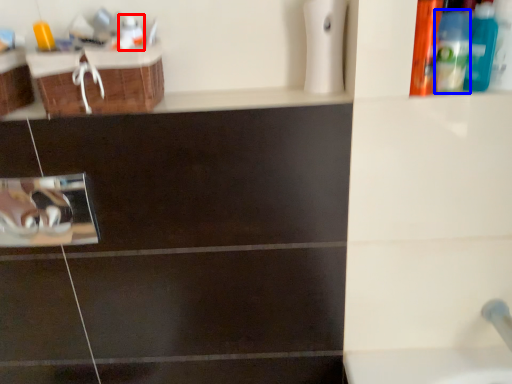
Question: Which of the following is the closest to the observer, mouthwash (highlighted by a red box) or mouthwash (highlighted by a blue box)?

Choices:
 (A) mouthwash
 (B) mouthwash

Answer: (B)